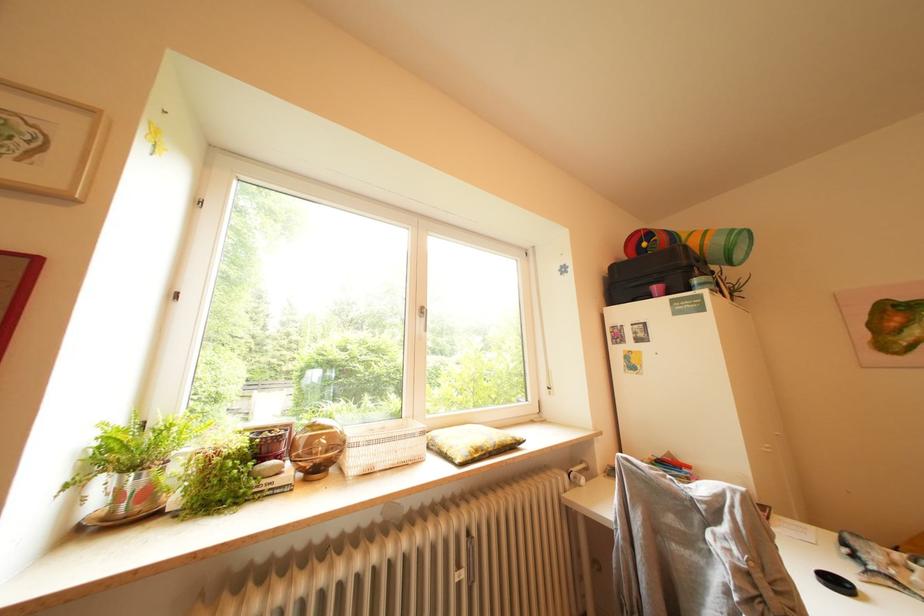
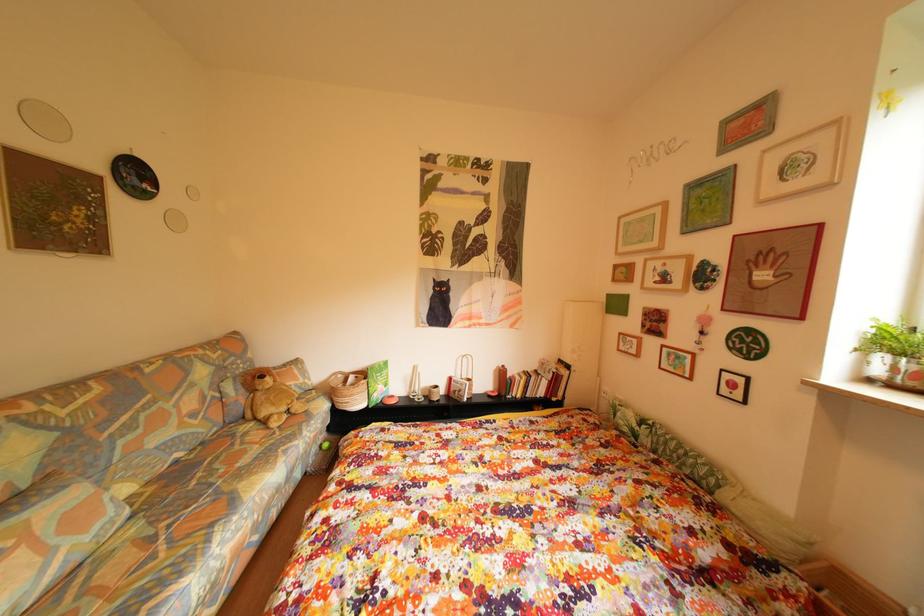
Question: How did the camera likely rotate?

Choices:
 (A) Left
 (B) Right
 (C) Up
 (D) Down

Answer: (A)